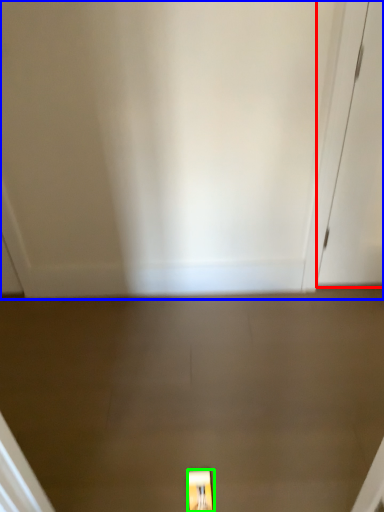
Question: Which object is the farthest from door (highlighted by a red box)? Choose among these: door (highlighted by a blue box) or light fixture (highlighted by a green box).

Choices:
 (A) door
 (B) light fixture

Answer: (B)